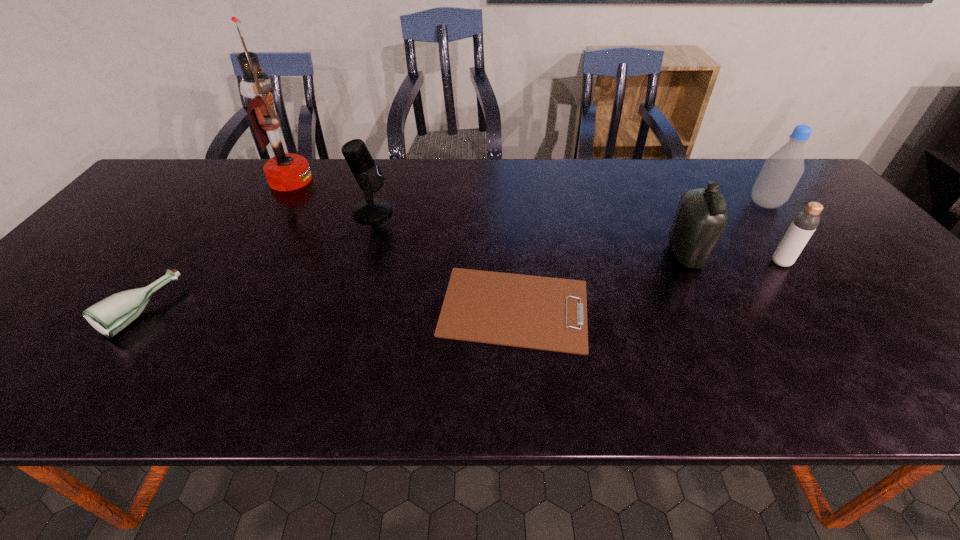
Locate an element on the screen. clipboard is located at coordinates (544, 313).

You are a GUI agent. You are given a task and a screenshot of the screen. Output one action in this format:
    pyautogui.click(x=<x>, y=<y>)
    Task: Click on the fourth object from right to left
    The height and width of the screenshot is (540, 960).
    Given the screenshot: What is the action you would take?
    pyautogui.click(x=544, y=313)

You are a GUI agent. You are given a task and a screenshot of the screen. Output one action in this format:
    pyautogui.click(x=<x>, y=<y>)
    Task: Click on the blank area located 0.230m on the front-facing side of the nutcracker
    This screenshot has width=960, height=540.
    Given the screenshot: What is the action you would take?
    pyautogui.click(x=386, y=180)

This screenshot has width=960, height=540. Find the location of `vacant space situated on the back of the farthest bottle`. vacant space situated on the back of the farthest bottle is located at coordinates (744, 178).

Locate an element on the screen. This screenshot has height=540, width=960. free location located on the stand of the microphone is located at coordinates (481, 211).

This screenshot has width=960, height=540. In order to click on vacant space located on the left of the fifth object from left to right in this screenshot , I will do click(x=537, y=255).

This screenshot has width=960, height=540. In order to click on vacant space located on the right of the third tallest bottle in this screenshot , I will do `click(855, 262)`.

The width and height of the screenshot is (960, 540). Identify the location of free spot located on the back of the nearest bottle. (229, 191).

At what (x,y) coordinates should I click in order to perform the action: click on vacant space located on the back of the fourth object from left to right. Please return your answer as a coordinate pair (x, y). The image size is (960, 540). Looking at the image, I should click on (508, 218).

Identify the location of nutcracker at the far edge. (285, 171).